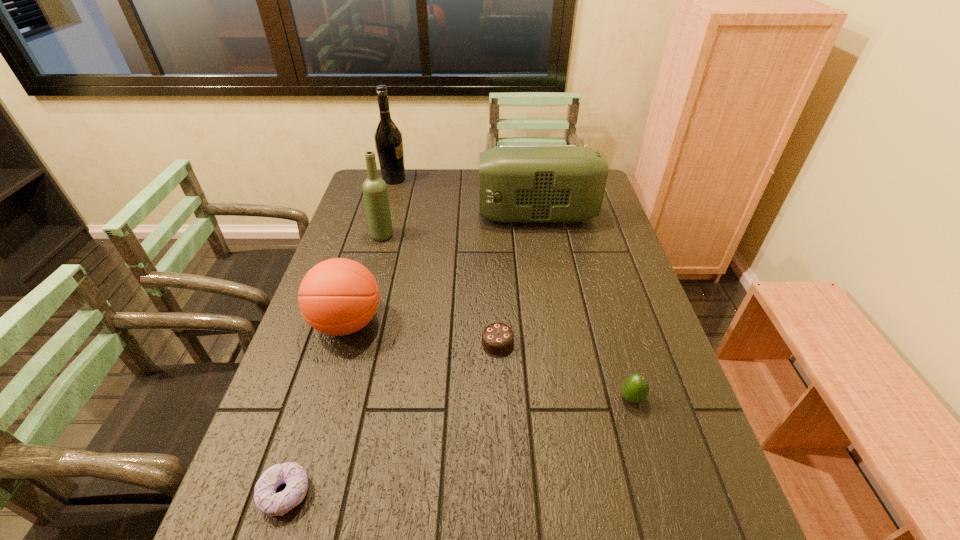
Locate an element on the screen. The height and width of the screenshot is (540, 960). free space between the farther wine bottle and the second shortest object is located at coordinates (446, 261).

Where is `unoccupied position between the farthest object and the basketball`? unoccupied position between the farthest object and the basketball is located at coordinates (371, 251).

I want to click on empty space between the second nearest object and the chocolate cake, so click(x=564, y=370).

Identify the location of empty space between the fourth tallest object and the doughnut. This screenshot has width=960, height=540. (316, 408).

Find the location of a particular element. The width and height of the screenshot is (960, 540). unoccupied area between the chocolate cake and the basketball is located at coordinates (422, 333).

At what (x,y) coordinates should I click in order to perform the action: click on empty space that is in between the nearest object and the second tallest object. Please return your answer as a coordinate pair (x, y). The image size is (960, 540). Looking at the image, I should click on (334, 364).

Identify the location of free space between the chocolate cake and the fourth shortest object. (422, 333).

This screenshot has width=960, height=540. I want to click on free space between the fourth tallest object and the sixth tallest object, so click(422, 333).

Image resolution: width=960 pixels, height=540 pixels. Identify the location of vacant area that lies between the fifth tallest object and the shorter wine bottle. (507, 316).

Image resolution: width=960 pixels, height=540 pixels. In order to click on the sixth closest object relative to the doughnut in this screenshot , I will do `click(388, 138)`.